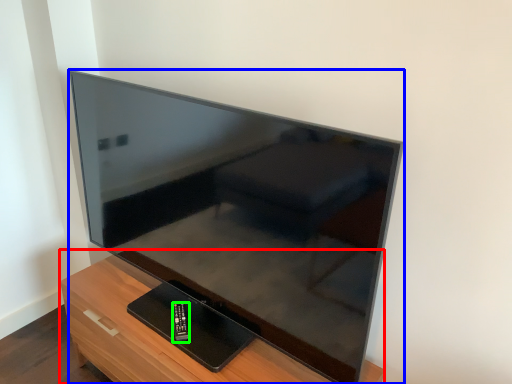
Question: Estimate the real-world distances between objects in this image. Which object is closer to furniture (highlighted by a red box), television (highlighted by a blue box) or control (highlighted by a green box)?

Choices:
 (A) television
 (B) control

Answer: (B)